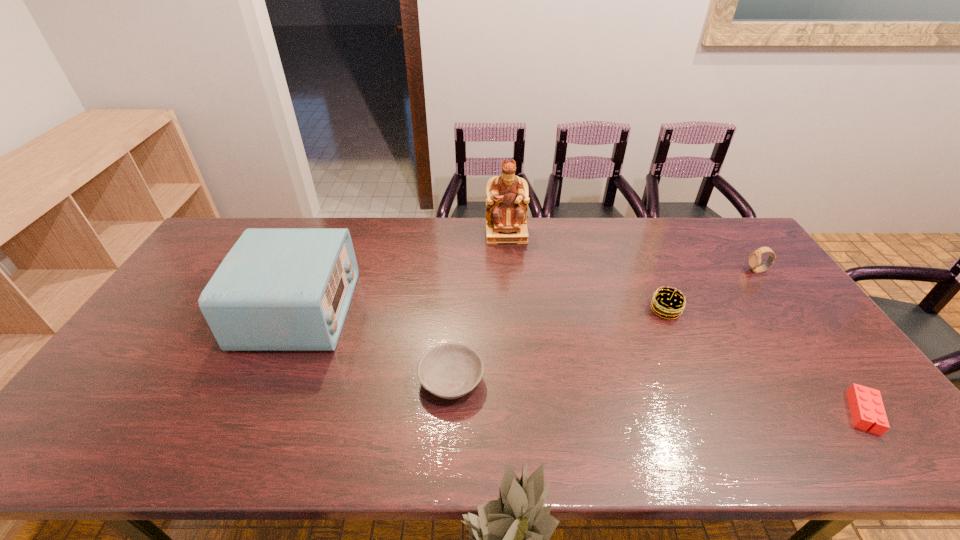
Image resolution: width=960 pixels, height=540 pixels. Identify the location of free location that satisfies the following two spatial constraints: 1. on the front side of the shortest object; 2. on the right side of the patty. point(710,413).

Locate an element on the screen. vacant space that satisfies the following two spatial constraints: 1. on the front panel of the bowl; 2. on the right side of the leftmost object is located at coordinates (269, 380).

Where is `vacant space that satisfies the following two spatial constraints: 1. on the front-facing side of the figurine; 2. on the front panel of the leftmost object`? The height and width of the screenshot is (540, 960). vacant space that satisfies the following two spatial constraints: 1. on the front-facing side of the figurine; 2. on the front panel of the leftmost object is located at coordinates (512, 310).

Image resolution: width=960 pixels, height=540 pixels. In order to click on free spot that satisfies the following two spatial constraints: 1. on the face of the Lego; 2. on the left side of the fourth shortest object in this screenshot , I will do `click(861, 413)`.

Find the location of a particular element. The width and height of the screenshot is (960, 540). vacant region that satisfies the following two spatial constraints: 1. on the front panel of the radio receiver; 2. on the back side of the fifth tallest object is located at coordinates (269, 380).

Image resolution: width=960 pixels, height=540 pixels. Find the location of `free space that satisfies the following two spatial constraints: 1. on the front panel of the fifth shortest object; 2. on the back side of the fourth object from left to right`. free space that satisfies the following two spatial constraints: 1. on the front panel of the fifth shortest object; 2. on the back side of the fourth object from left to right is located at coordinates (299, 310).